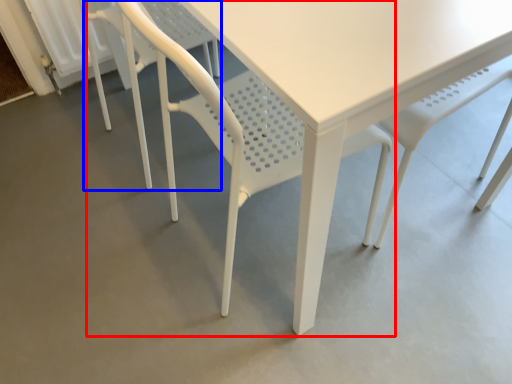
Question: Among these objects, which one is farthest to the camera, chair (highlighted by a red box) or chair (highlighted by a blue box)?

Choices:
 (A) chair
 (B) chair

Answer: (B)